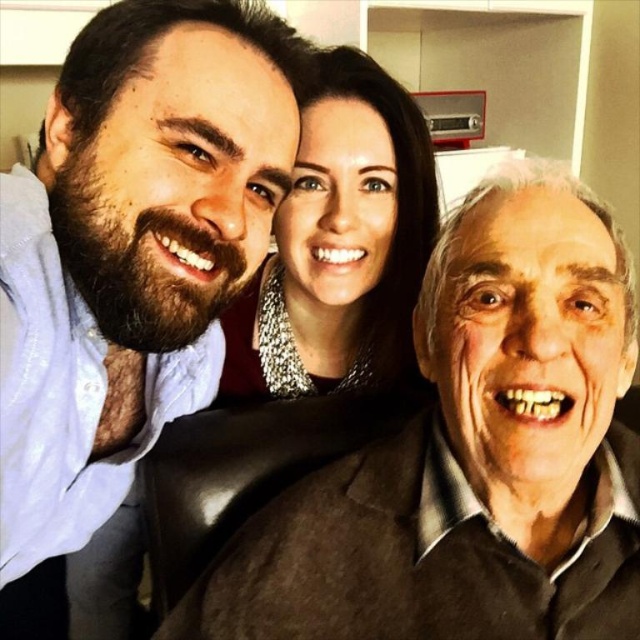
Between point (486, 534) and point (301, 192), which one is positioned behind?

Positioned behind is point (301, 192).

Can you confirm if matte black jacket at center is positioned to the right of silver metallic necklace at upper center?

Indeed, matte black jacket at center is positioned on the right side of silver metallic necklace at upper center.

Identify the location of matte black jacket at center. Image resolution: width=640 pixels, height=640 pixels. (470, 456).

What are the coordinates of `matte black jacket at center` in the screenshot? It's located at (470, 456).

Consider the image. Is matte black jacket at center taller than matte blue shirt at left?

In fact, matte black jacket at center may be shorter than matte blue shirt at left.

Who is higher up, matte black jacket at center or matte blue shirt at left?

matte blue shirt at left is above.

What do you see at coordinates (470, 456) in the screenshot? I see `matte black jacket at center` at bounding box center [470, 456].

The height and width of the screenshot is (640, 640). Identify the location of matte black jacket at center. (x=470, y=456).

Which is above, matte blue shirt at left or silver metallic necklace at upper center?

silver metallic necklace at upper center is above.

What do you see at coordinates (129, 262) in the screenshot? I see `matte blue shirt at left` at bounding box center [129, 262].

At what (x,y) coordinates should I click in order to perform the action: click on matte blue shirt at left. Please return your answer as a coordinate pair (x, y). Image resolution: width=640 pixels, height=640 pixels. Looking at the image, I should click on (129, 262).